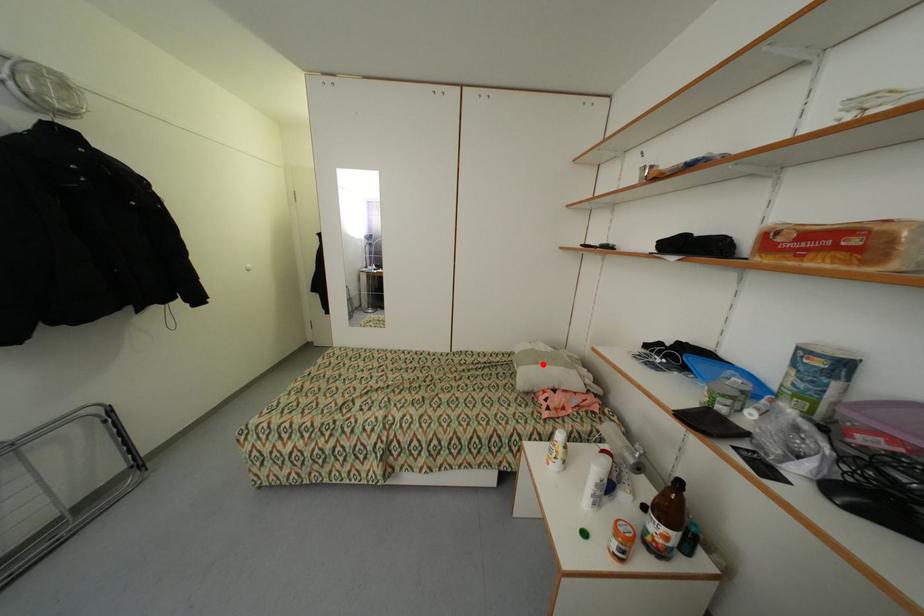
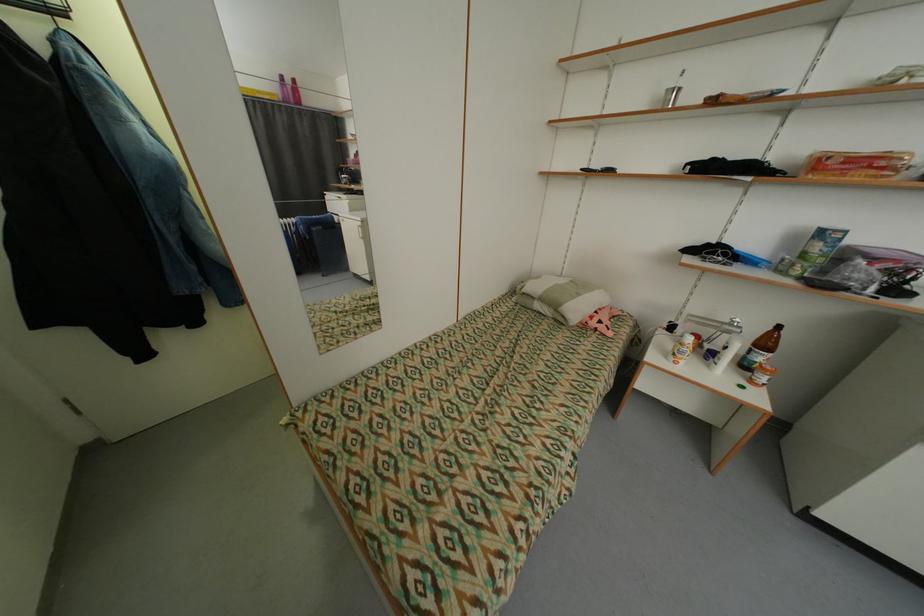
Question: I am providing you with two images of the same scene from different viewpoints. Image1 has a red point marked. In image2, the corresponding 3D location appears at what relative position? Reply with the corresponding letter.

Choices:
 (A) Closer
 (B) Farther

Answer: (A)